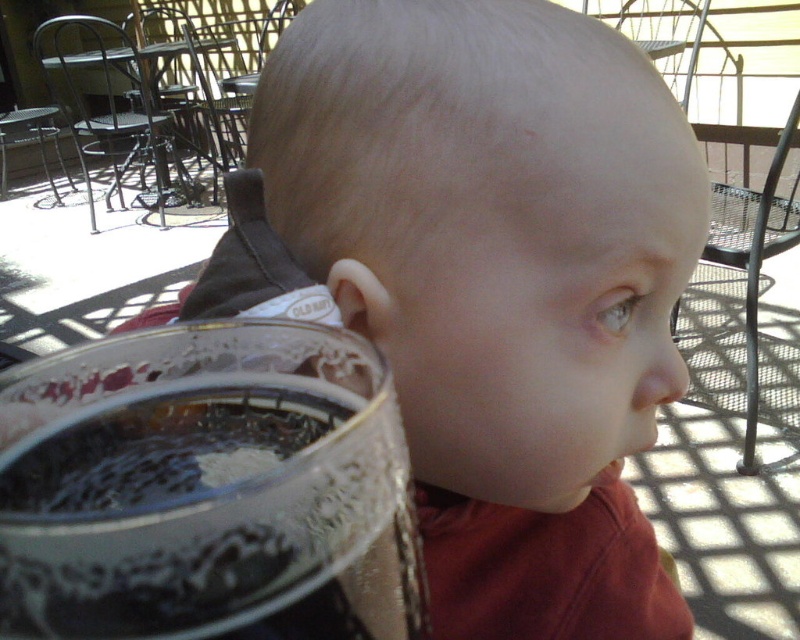
Question: Can you confirm if matte glass cup at center-left is thinner than clear glass beer glass at lower left?

Choices:
 (A) yes
 (B) no

Answer: (B)

Question: Is matte glass cup at center-left wider than clear glass beer glass at lower left?

Choices:
 (A) yes
 (B) no

Answer: (A)

Question: Which object appears farthest from the camera in this image?

Choices:
 (A) matte glass cup at center-left
 (B) clear glass beer glass at lower left

Answer: (A)

Question: Can you confirm if matte glass cup at center-left is positioned to the right of clear glass beer glass at lower left?

Choices:
 (A) yes
 (B) no

Answer: (A)

Question: Which of the following is the closest to the observer?

Choices:
 (A) (88, 586)
 (B) (204, 280)

Answer: (A)